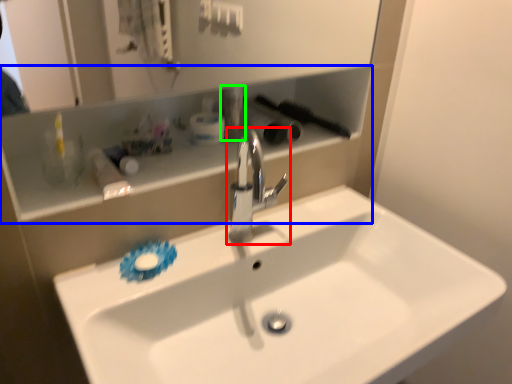
Question: Which object is the closest to the tap (highlighted by a red box)? Choose among these: shelve (highlighted by a blue box) or toiletry (highlighted by a green box).

Choices:
 (A) shelve
 (B) toiletry

Answer: (B)